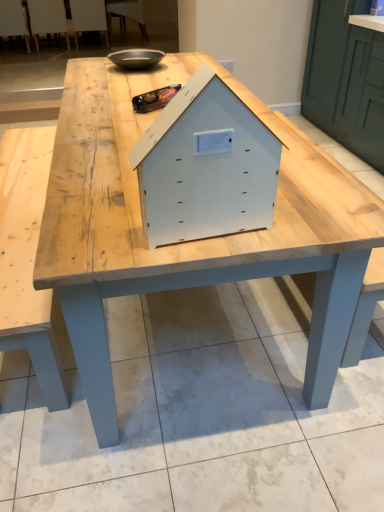
Identify the location of free space in front of matte black bowl at upper center. (110, 81).